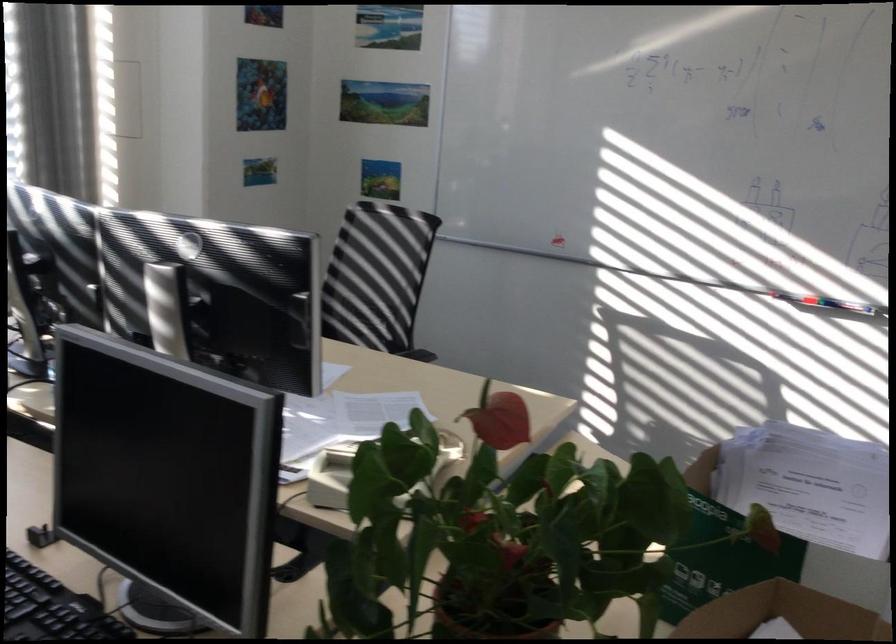
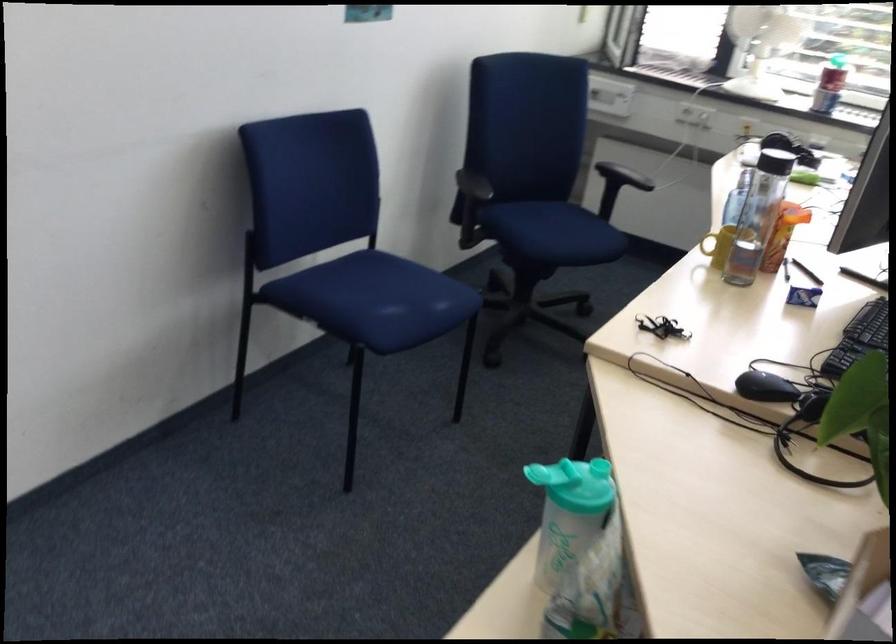
How did the camera likely rotate?

The camera rotated toward left-down.